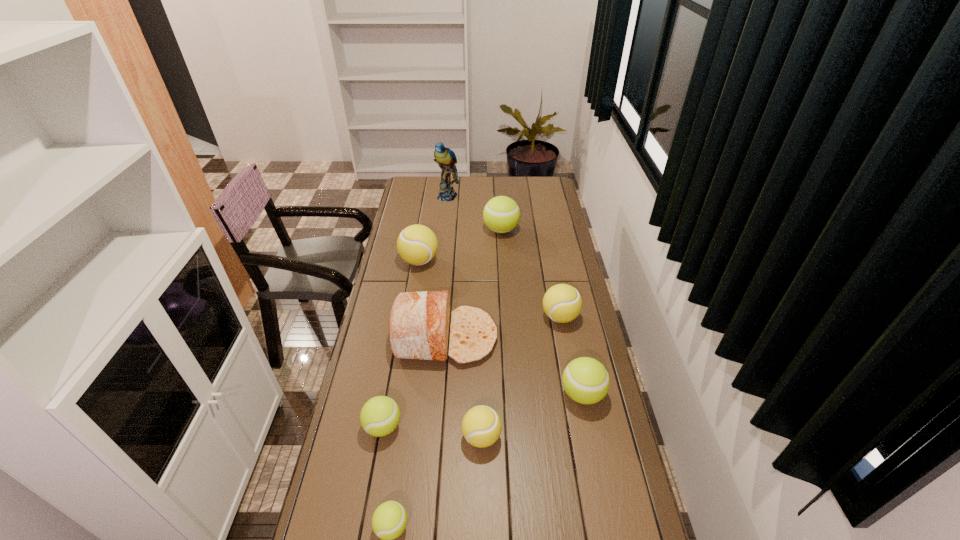
Find the location of a particular element. This screenshot has height=540, width=960. free space located 0.050m on the front of the third biggest green tennis ball is located at coordinates (377, 461).

Find the location of a particular element. The height and width of the screenshot is (540, 960). object that is at the far edge is located at coordinates (446, 159).

Locate an element on the screen. bread located at the left edge is located at coordinates (419, 322).

You are a GUI agent. You are given a task and a screenshot of the screen. Output one action in this format:
    pyautogui.click(x=<x>, y=<y>)
    Task: Click on the vacant space at the far edge of the desktop
    This screenshot has width=960, height=540.
    Given the screenshot: What is the action you would take?
    pyautogui.click(x=493, y=180)

In the image, there is a desktop. Identify the location of vacant space at the left edge. This screenshot has width=960, height=540. (391, 380).

The height and width of the screenshot is (540, 960). In the image, there is a desktop. What are the coordinates of `vacant space at the right edge` in the screenshot? It's located at (554, 246).

Locate an element on the screen. The image size is (960, 540). free space between the second farthest tennis ball and the rightmost yellow tennis ball is located at coordinates (490, 289).

The width and height of the screenshot is (960, 540). In order to click on object that can be found as the sixth closest to the bread in this screenshot , I will do `click(501, 214)`.

At what (x,y) coordinates should I click in order to perform the action: click on object that is the fourth closest one to the nearest object. Please return your answer as a coordinate pair (x, y). The width and height of the screenshot is (960, 540). Looking at the image, I should click on (585, 380).

Where is `tennis ball that stands as the second closest to the biggest yellow tennis ball`? This screenshot has width=960, height=540. tennis ball that stands as the second closest to the biggest yellow tennis ball is located at coordinates (562, 303).